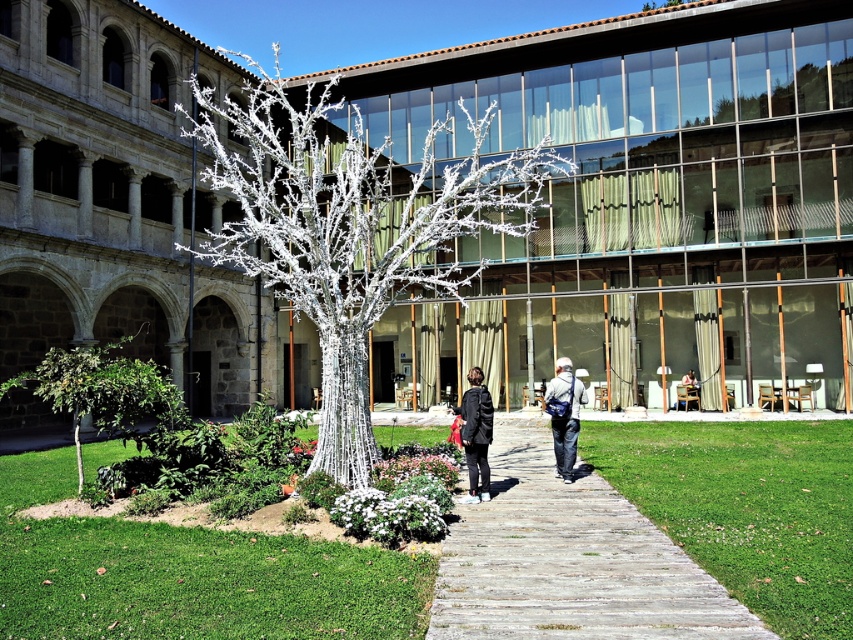
Does silver metallic tree at center appear under wooden walkway at center?

Actually, silver metallic tree at center is above wooden walkway at center.

The height and width of the screenshot is (640, 853). I want to click on silver metallic tree at center, so click(x=352, y=228).

Where is `silver metallic tree at center`? silver metallic tree at center is located at coordinates (352, 228).

Between silver metallic tree at center and matte black backpack at center, which one appears on the left side from the viewer's perspective?

Positioned to the left is silver metallic tree at center.

Which is in front, point (231, 120) or point (561, 428)?

Point (561, 428)

Locate an element on the screen. This screenshot has height=640, width=853. silver metallic tree at center is located at coordinates (352, 228).

Is wooden walkway at center bigger than dark gray fabric jacket at center?

Yes, wooden walkway at center is bigger than dark gray fabric jacket at center.

Does wooden walkway at center come behind dark gray fabric jacket at center?

No.

Based on the photo, measure the distance between point (498, 508) and camera.

9.41 meters

This screenshot has width=853, height=640. I want to click on wooden walkway at center, so click(569, 561).